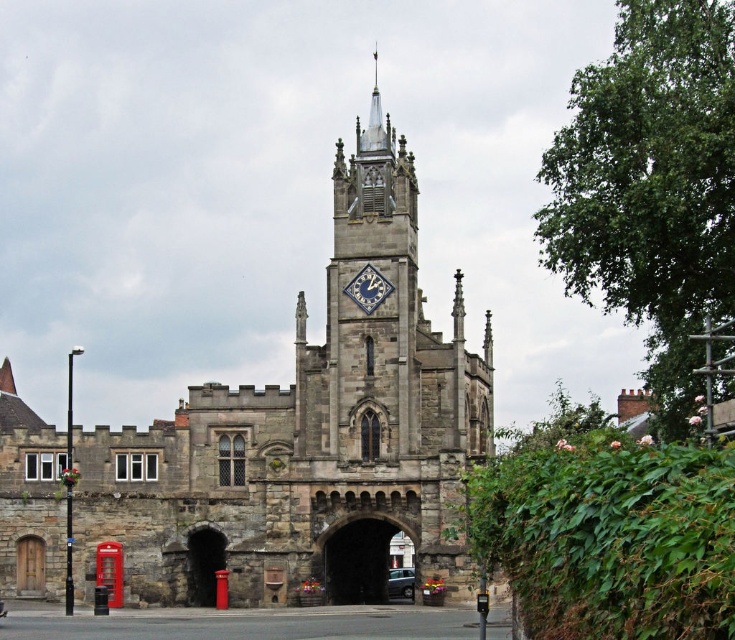
Question: Which point is farther to the camera?

Choices:
 (A) metallic gray car at center
 (B) stone church at center

Answer: (A)

Question: Is stone church at center to the right of metallic gray car at center from the viewer's perspective?

Choices:
 (A) yes
 (B) no

Answer: (B)

Question: Can you confirm if stone church at center is positioned to the right of metallic gray car at center?

Choices:
 (A) no
 (B) yes

Answer: (A)

Question: Among these objects, which one is farthest from the camera?

Choices:
 (A) metallic gray car at center
 (B) stone church at center

Answer: (A)

Question: Is stone church at center bigger than metallic gray car at center?

Choices:
 (A) no
 (B) yes

Answer: (B)